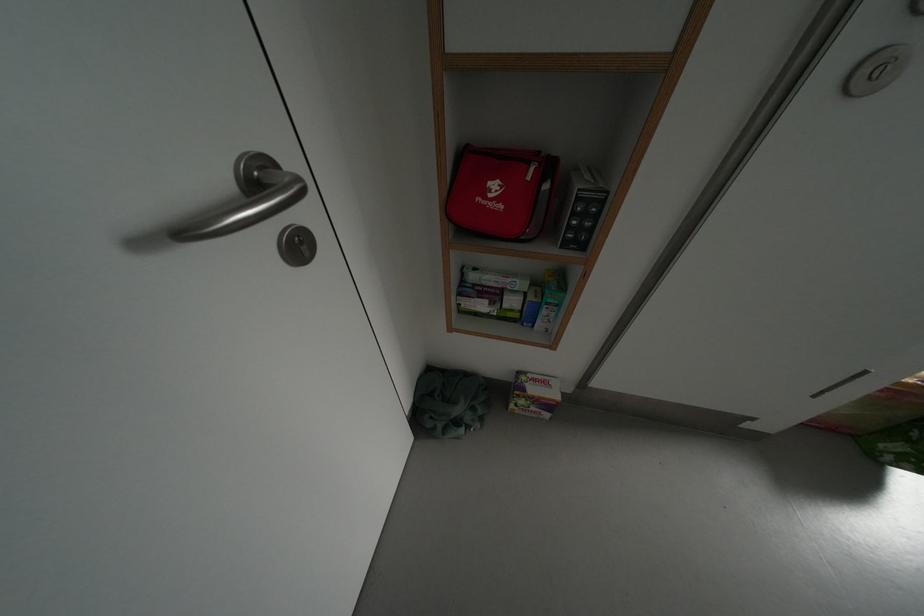
This screenshot has height=616, width=924. Identify the location of recessed door handle. (246, 200).